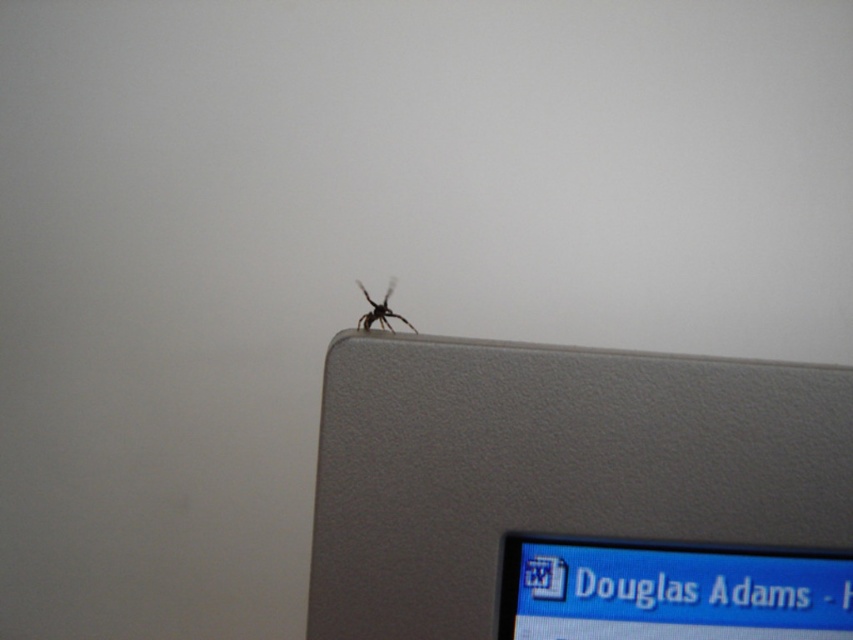
Which of these two, matte gray computer monitor at upper right or black fuzzy spider at upper center, stands shorter?

black fuzzy spider at upper center

Is matte gray computer monitor at upper right bigger than black fuzzy spider at upper center?

Indeed, matte gray computer monitor at upper right has a larger size compared to black fuzzy spider at upper center.

Is point (693, 627) farther from camera compared to point (363, 296)?

Yes, it is behind point (363, 296).

Locate an element on the screen. matte gray computer monitor at upper right is located at coordinates (670, 592).

Between satin silver laptop at upper right and black fuzzy spider at upper center, which one has more height?

satin silver laptop at upper right is taller.

Is the position of satin silver laptop at upper right more distant than that of black fuzzy spider at upper center?

No, it is not.

Which is behind, point (749, 442) or point (364, 321)?

Positioned behind is point (364, 321).

The height and width of the screenshot is (640, 853). I want to click on satin silver laptop at upper right, so click(x=549, y=465).

Is the position of satin silver laptop at upper right less distant than that of matte gray computer monitor at upper right?

Yes, it is in front of matte gray computer monitor at upper right.

This screenshot has width=853, height=640. Find the location of `satin silver laptop at upper right`. satin silver laptop at upper right is located at coordinates (549, 465).

Who is more distant from viewer, (408, 452) or (653, 621)?

The point (653, 621) is more distant.

Identify the location of satin silver laptop at upper right. (549, 465).